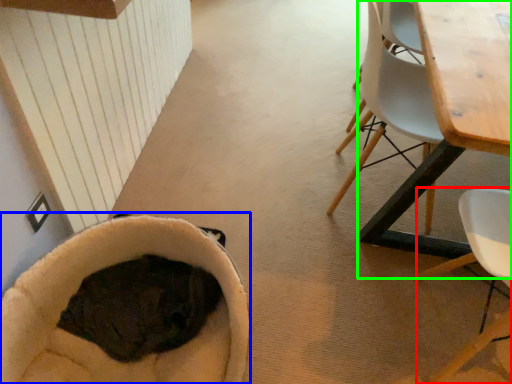
Question: Based on their relative distances, which object is nearer to chair (highlighted by a red box)? Choose from bean bag chair (highlighted by a blue box) and table (highlighted by a green box).

Choices:
 (A) bean bag chair
 (B) table

Answer: (B)